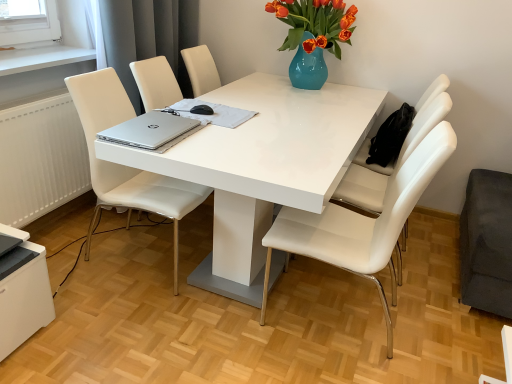
I want to click on vacant area that is situated to the right of white glossy desktop at lower left, so click(73, 331).